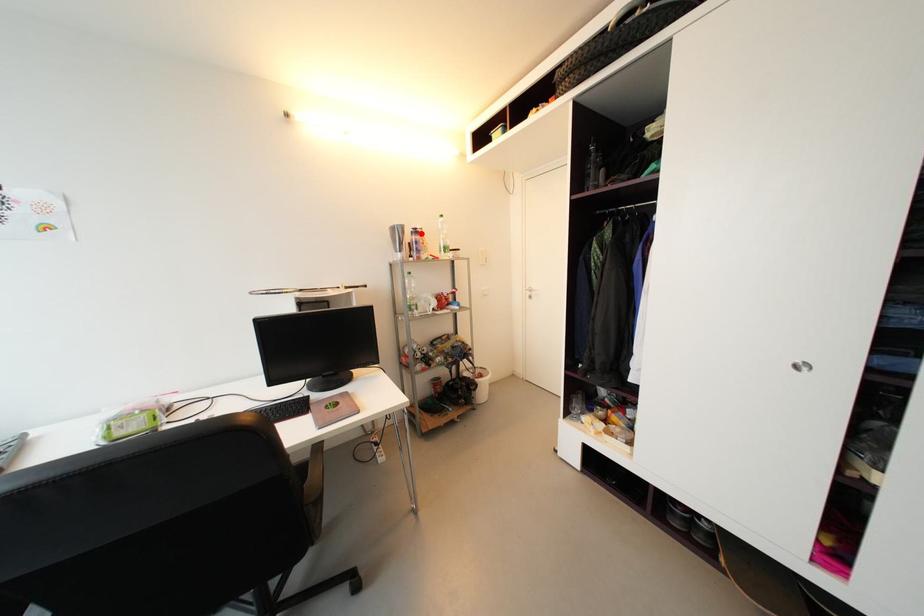
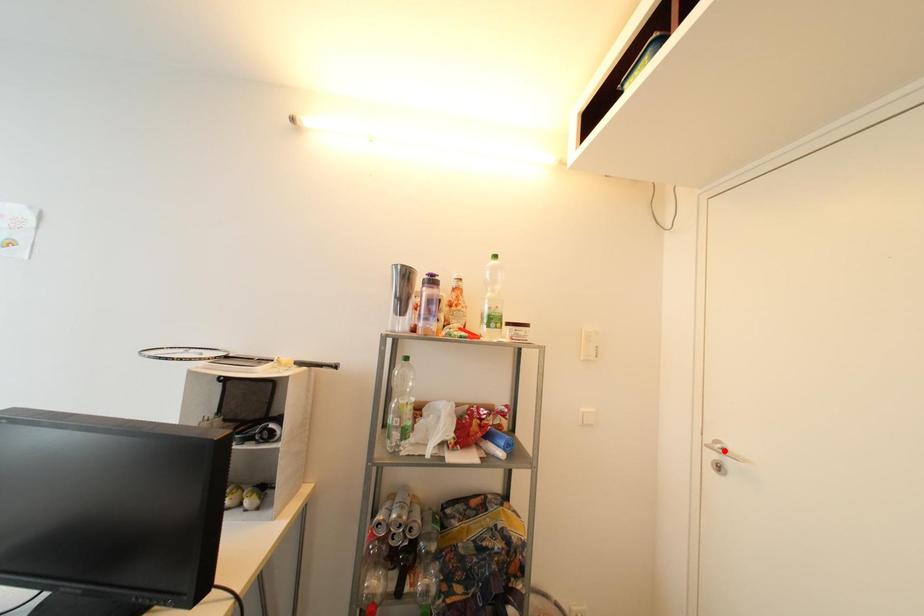
I am providing you with two images of the same scene from different viewpoints. A red point is marked on the first image and another point is marked on the second image. Do the highlighted points in image1 and image2 indicate the same real-world spot?

No